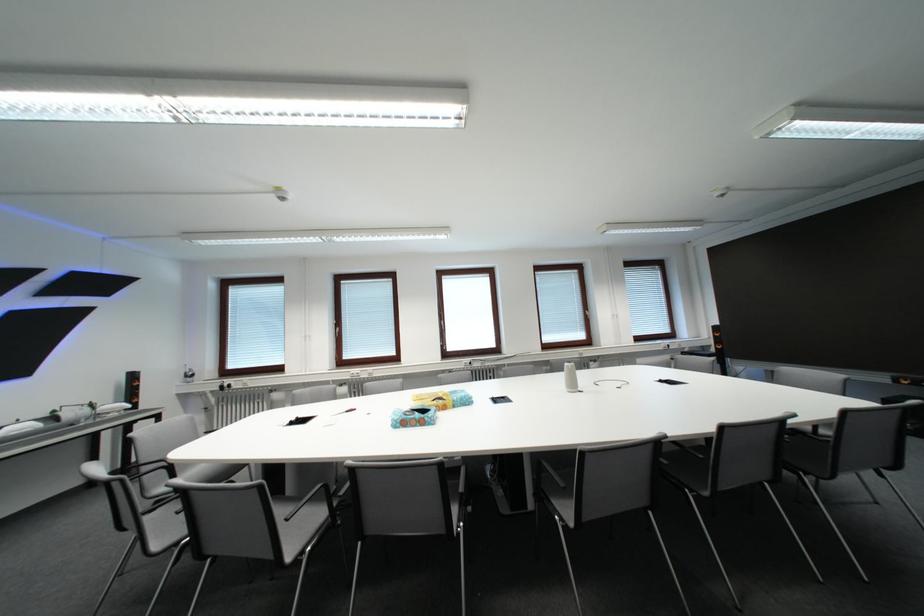
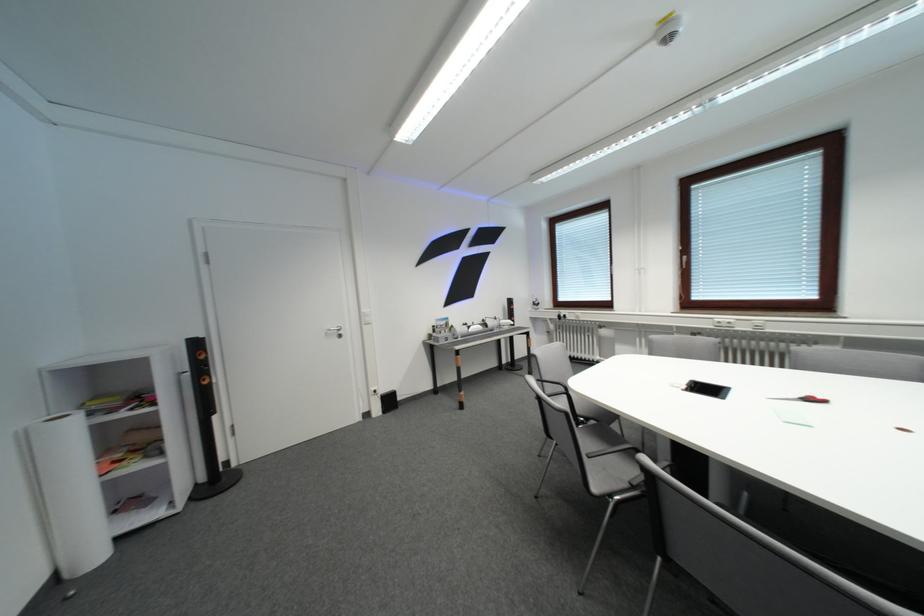
In the second image, find the point that corresponds to point (152, 464) in the first image.

(554, 381)